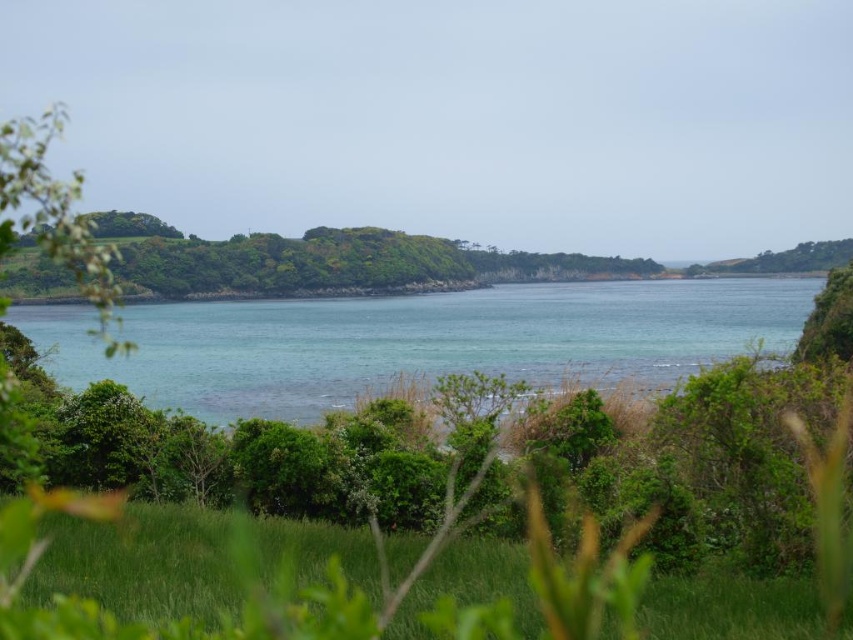
Measure the distance between point [573,296] and camera.

A distance of 484.41 feet exists between point [573,296] and camera.

Does clear blue water at center have a greater height compared to green grassy at lower center?

Yes, clear blue water at center is taller than green grassy at lower center.

Does point (645, 348) lie behind point (26, 632)?

Yes, it is behind point (26, 632).

The height and width of the screenshot is (640, 853). What are the coordinates of `clear blue water at center` in the screenshot? It's located at (418, 340).